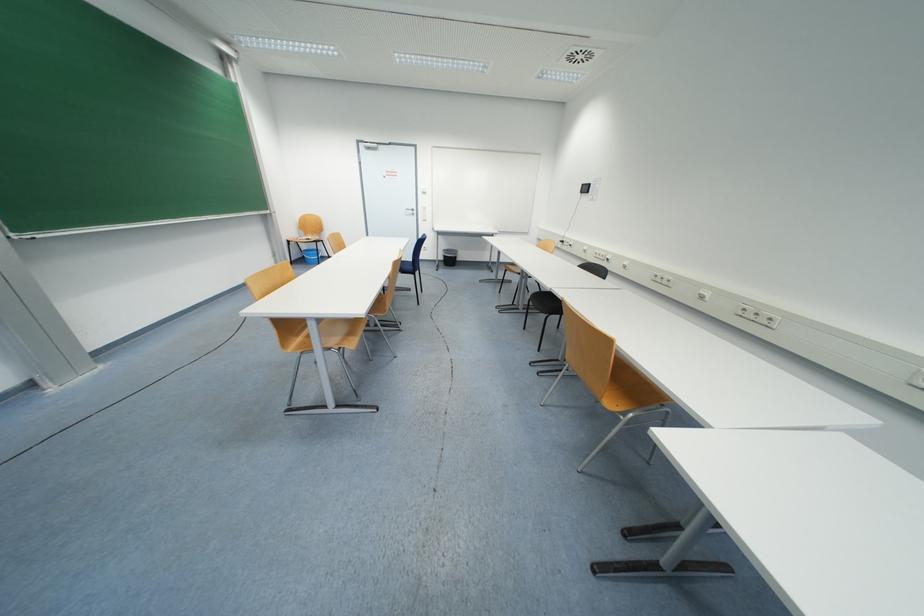
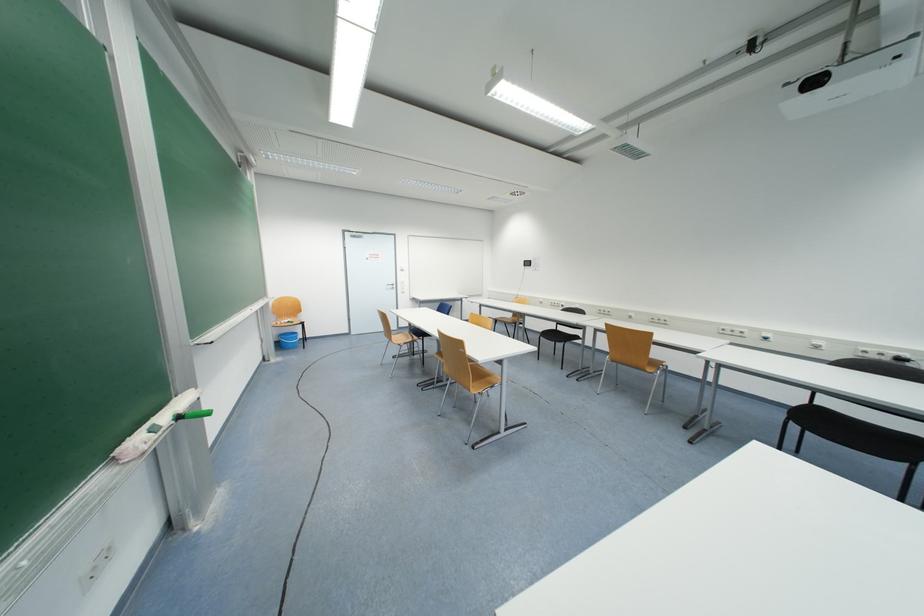
Question: I am providing you with two images of the same scene from different viewpoints. After the viewpoint changes to image2, which objects are now occluded?

Choices:
 (A) black trash can
 (B) blue plastic bucket
 (C) chair sitting surface
 (D) black foot pedal

Answer: (A)